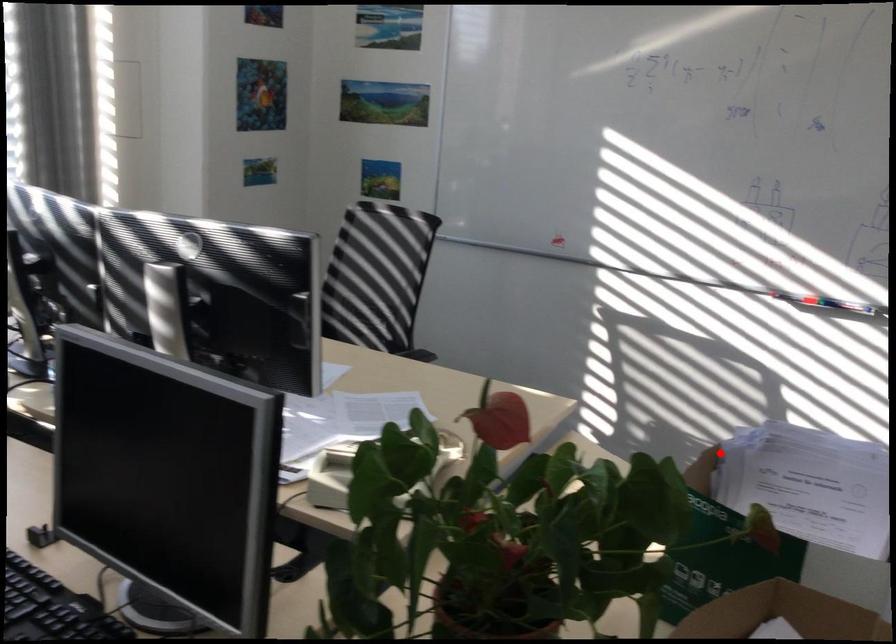
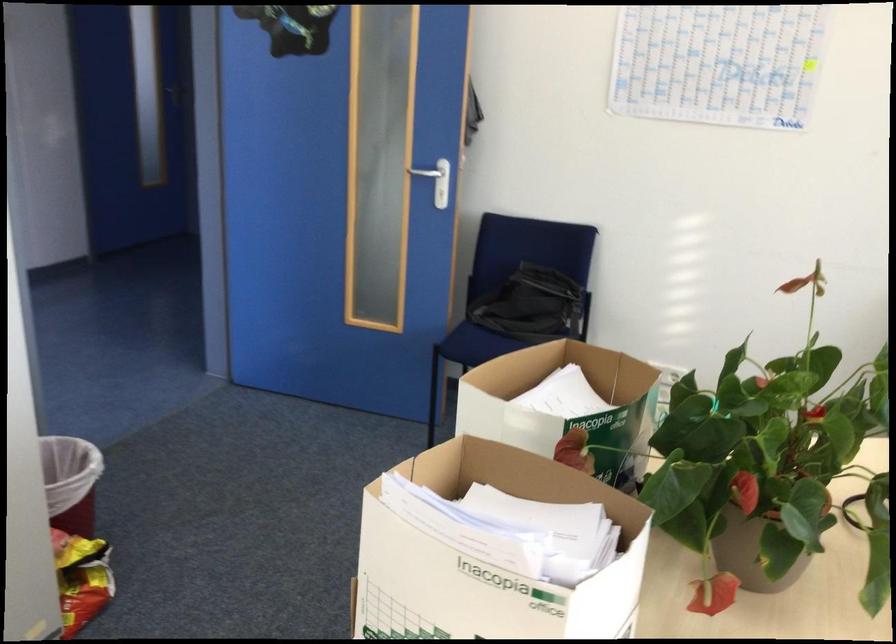
Where in the second image is the point corresponding to the highlighted location from the first image?

(489, 558)